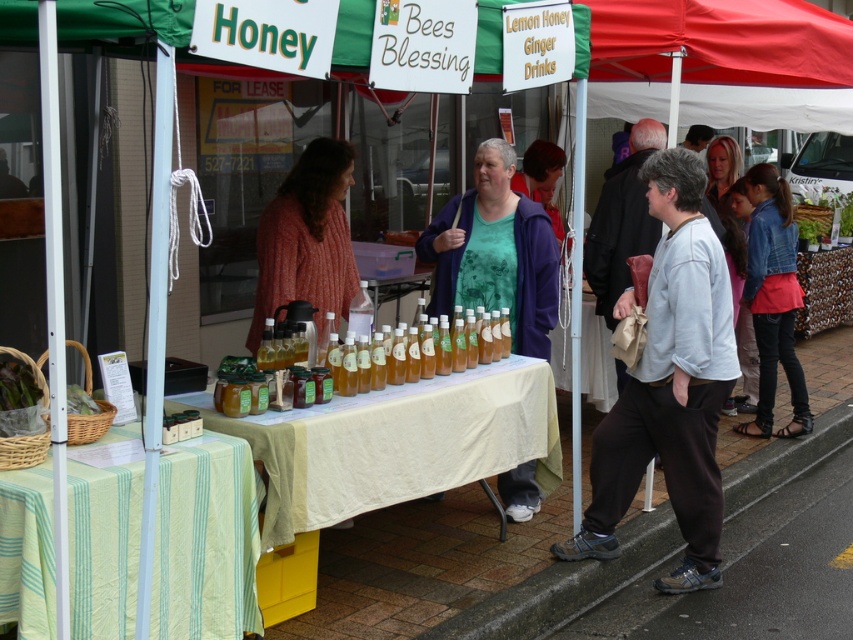
What do you see at coordinates (206, 541) in the screenshot? I see `green striped fabric at lower left` at bounding box center [206, 541].

Locate an element on the screen. The width and height of the screenshot is (853, 640). green striped fabric at lower left is located at coordinates pos(206,541).

Does light gray cotton shirt at center appear over blonde hair at upper right?

Incorrect, light gray cotton shirt at center is not positioned above blonde hair at upper right.

What do you see at coordinates (670, 385) in the screenshot? I see `light gray cotton shirt at center` at bounding box center [670, 385].

The height and width of the screenshot is (640, 853). I want to click on light gray cotton shirt at center, so click(x=670, y=385).

Can you confirm if green striped fabric at lower left is positioned above denim jacket at lower right?

Actually, green striped fabric at lower left is below denim jacket at lower right.

Where is `green striped fabric at lower left`? This screenshot has width=853, height=640. green striped fabric at lower left is located at coordinates (206, 541).

Image resolution: width=853 pixels, height=640 pixels. I want to click on green striped fabric at lower left, so click(206, 541).